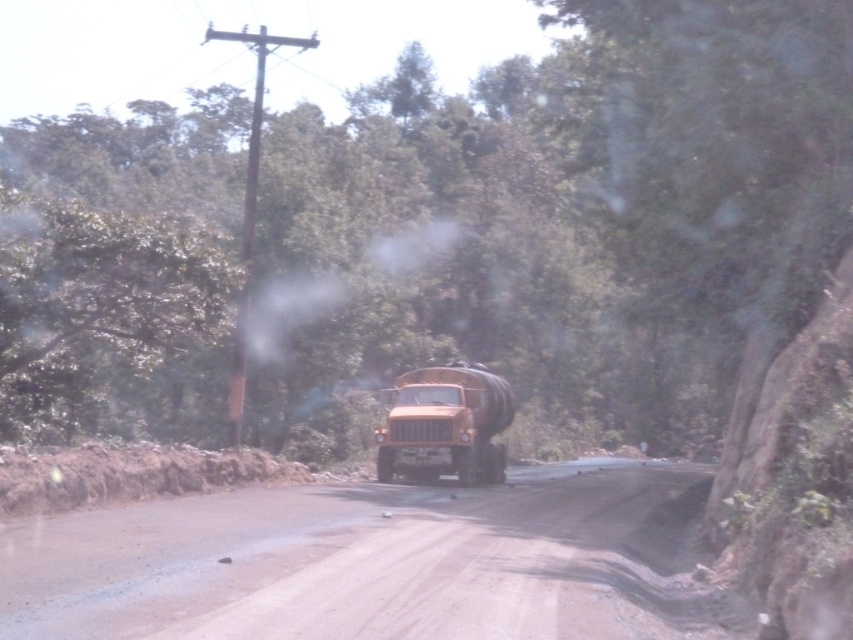
Question: Is green leafy tree at center positioned in front of matte orange truck at center?

Choices:
 (A) no
 (B) yes

Answer: (B)

Question: Is green leafy tree at center bigger than dull brown dirt track at center?

Choices:
 (A) no
 (B) yes

Answer: (B)

Question: Can you confirm if green leafy tree at center is wider than matte orange truck at center?

Choices:
 (A) yes
 (B) no

Answer: (A)

Question: Which object is farther from the camera taking this photo?

Choices:
 (A) matte orange truck at center
 (B) brown wooden telegraph pole at left

Answer: (A)

Question: Which of the following is the closest to the observer?

Choices:
 (A) (57, 634)
 (B) (207, 216)

Answer: (A)

Question: Which point appears closest to the camera in this image?

Choices:
 (A) (38, 336)
 (B) (480, 396)

Answer: (A)